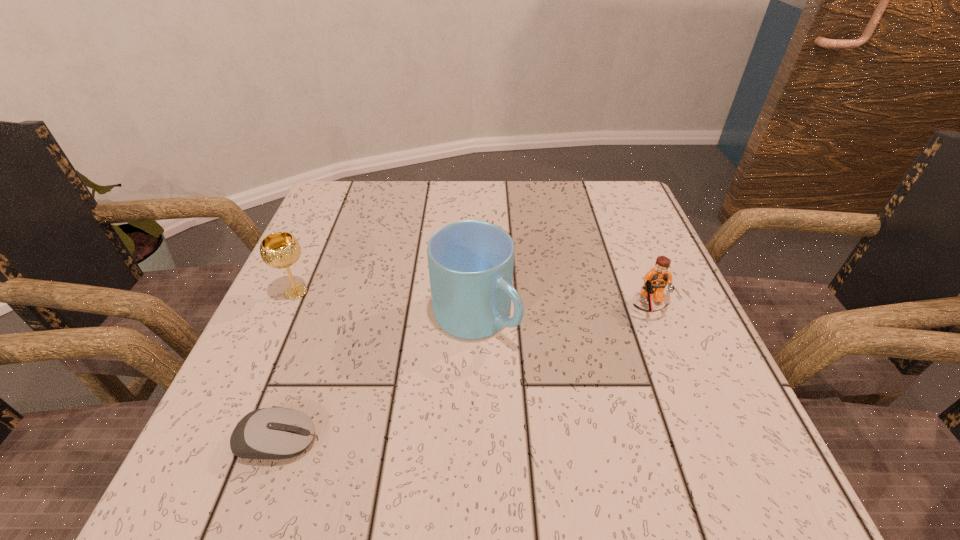
Locate an element on the screen. The image size is (960, 540). free region located 0.060m on the wheel side of the computer equipment is located at coordinates (357, 441).

Where is `object at the near edge`? The width and height of the screenshot is (960, 540). object at the near edge is located at coordinates (275, 433).

Locate an element on the screen. This screenshot has height=540, width=960. chalice present at the left edge is located at coordinates (279, 250).

Image resolution: width=960 pixels, height=540 pixels. Identify the location of computer equipment present at the left edge. (275, 433).

The image size is (960, 540). Find the location of `object positioned at the right edge`. object positioned at the right edge is located at coordinates (655, 281).

At what (x,y) coordinates should I click in order to perform the action: click on object located in the near left corner section of the desktop. Please return your answer as a coordinate pair (x, y). Image resolution: width=960 pixels, height=540 pixels. Looking at the image, I should click on (275, 433).

This screenshot has height=540, width=960. In the image, there is a desktop. In order to click on free space at the far edge in this screenshot , I will do `click(399, 205)`.

At what (x,y) coordinates should I click in order to perform the action: click on vacant space at the near edge. Please return your answer as a coordinate pair (x, y). Looking at the image, I should click on (608, 487).

What are the coordinates of `free space at the left edge of the desktop` in the screenshot? It's located at (310, 291).

Identify the location of free region at the right edge. (641, 434).